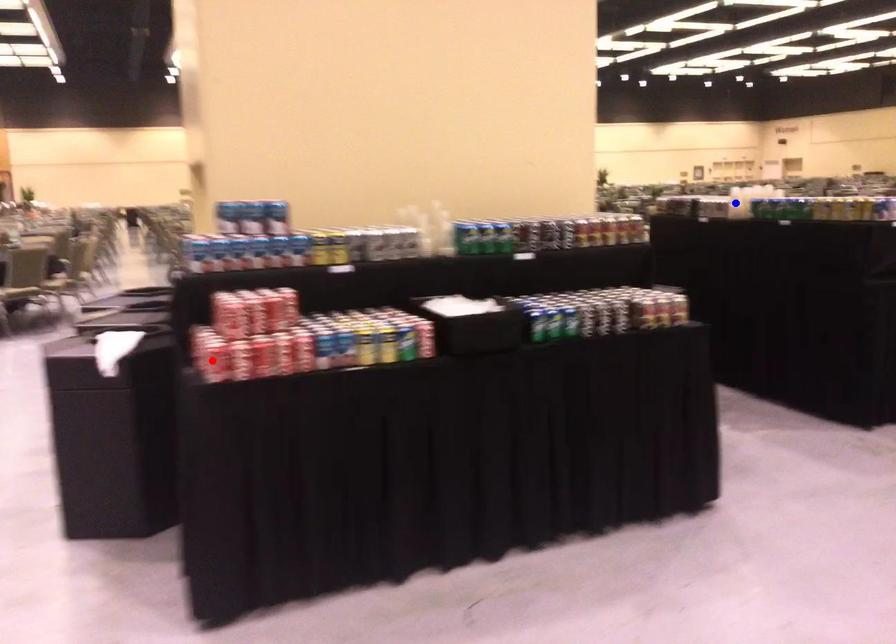
Question: Which of the two points in the image is closer to the camera?

Choices:
 (A) Blue point is closer.
 (B) Red point is closer.

Answer: (B)